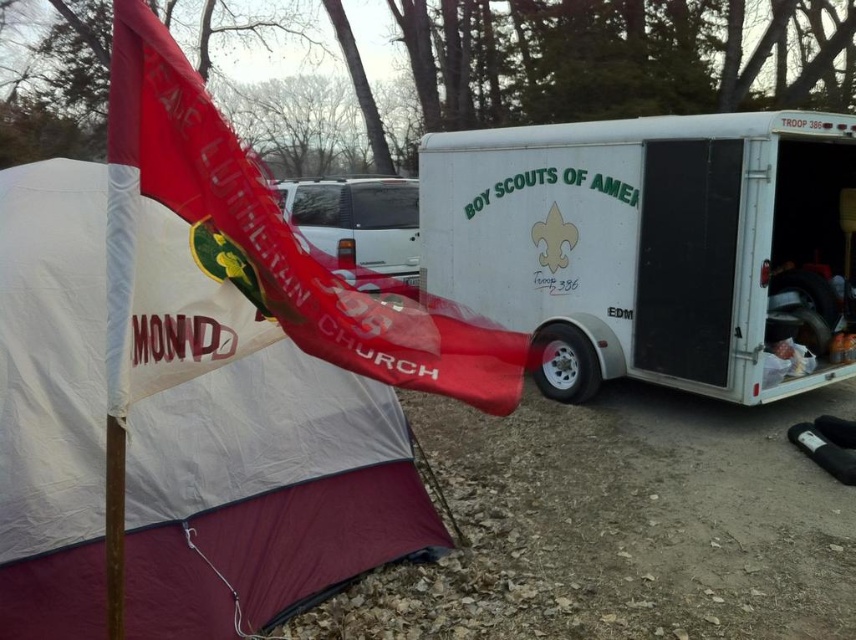
You are planning to set up a new tent in the camping area. The existing white nylon tent at left is located at coordinates point 0.725, 0.294. If you want to place your tent 2 meters away from it in the direction of the Boy Scouts trailer, where should you place your tent?

To place your tent 2 meters away from the white nylon tent at left in the direction of the Boy Scouts trailer, you would need to calculate the new coordinates based on the direction vector from the existing tent to the trailer. However, without knowing the scale of the coordinate system or the exact distance between the tent and the trailer, it is not possible to determine the precise coordinates for the new tent placement.

You are planning to set up a campsite and need to know which object takes up more area. Based on the scene, which one is larger in size between the white nylon tent at left and the white matte trailer at right?

The white matte trailer at right occupies more space than the white nylon tent at left, so the trailer is larger in size.